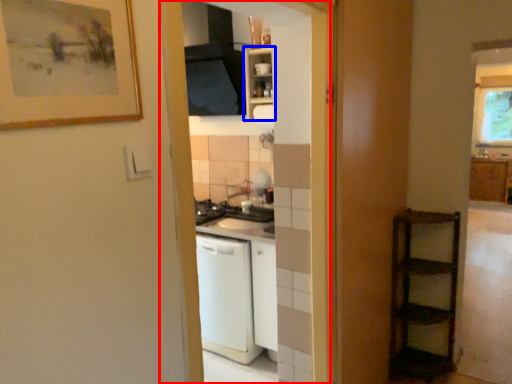
Question: Which object is closer to the camera taking this photo, screen door (highlighted by a red box) or cabinetry (highlighted by a blue box)?

Choices:
 (A) screen door
 (B) cabinetry

Answer: (A)